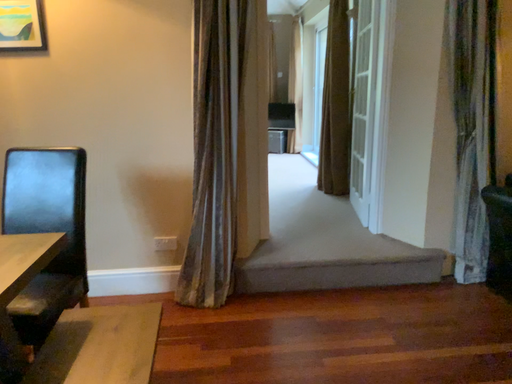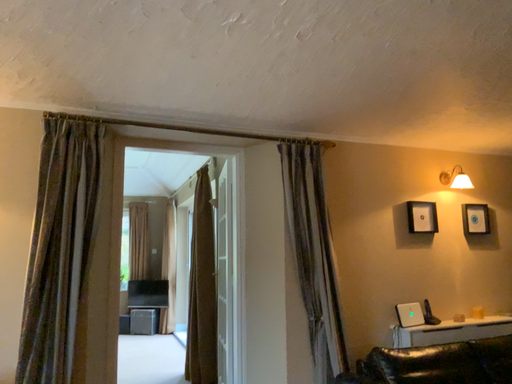
Question: How did the camera likely rotate when shooting the video?

Choices:
 (A) rotated left
 (B) rotated right

Answer: (B)